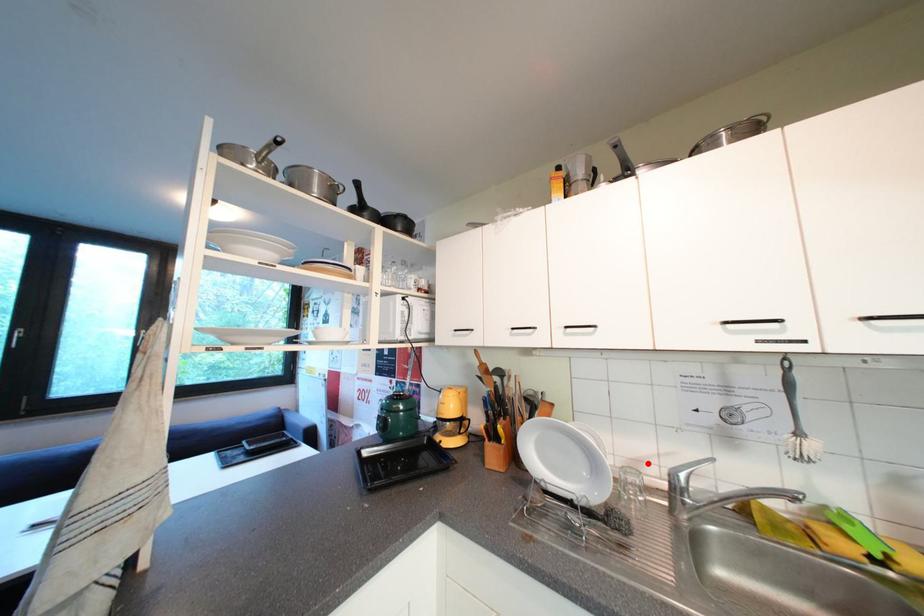
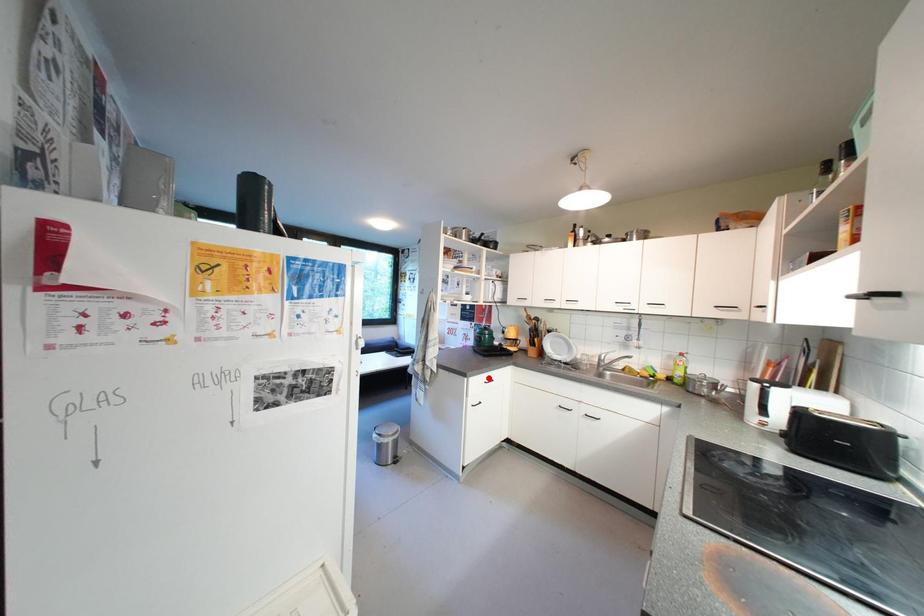
I am providing you with two images of the same scene from different viewpoints. A red point is marked on the first image and another point is marked on the second image. Is the red point in image1 aligned with the point shown in image2?

No